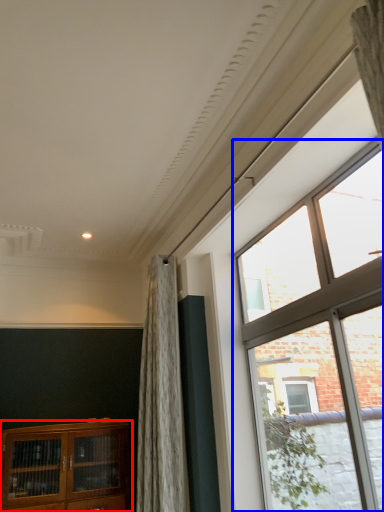
Question: Which point is closer to the camera, cabinetry (highlighted by a red box) or window (highlighted by a blue box)?

Choices:
 (A) cabinetry
 (B) window

Answer: (B)